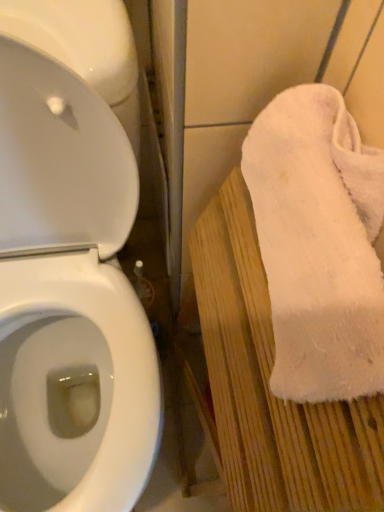
Find the location of a particular element. The image size is (384, 512). white soft towel at right is located at coordinates (269, 387).

The image size is (384, 512). Describe the element at coordinates (269, 387) in the screenshot. I see `white soft towel at right` at that location.

At what (x,y) coordinates should I click in order to perform the action: click on white soft towel at right. Please return your answer as a coordinate pair (x, y). Image resolution: width=384 pixels, height=512 pixels. Looking at the image, I should click on (269, 387).